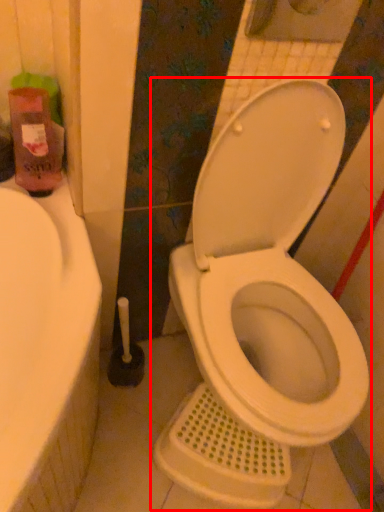
Question: In this image, where is toilet (annotated by the red box) located relative to cleaning product?

Choices:
 (A) right
 (B) left

Answer: (A)